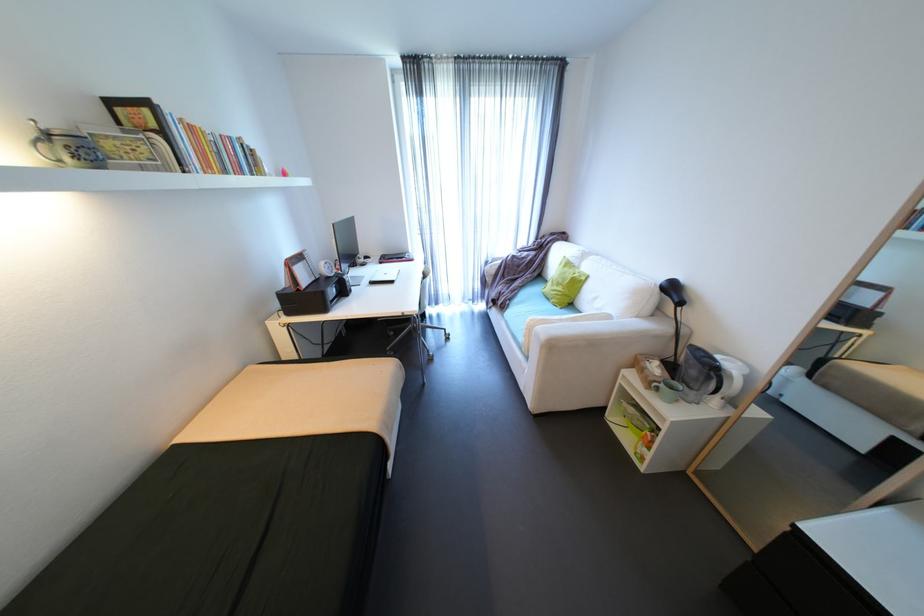
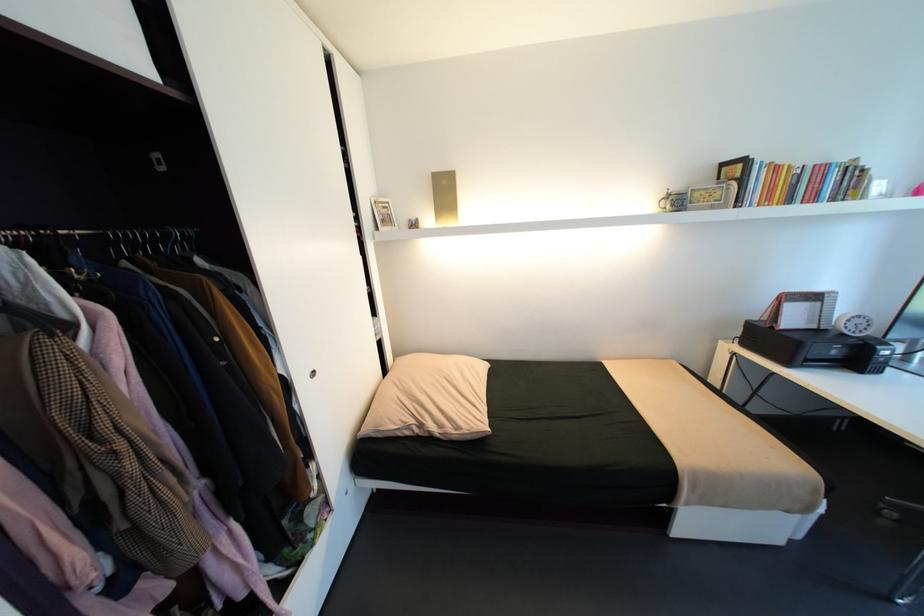
Where in the second image is the point corresponding to (x=306, y=290) from the first image?

(779, 328)